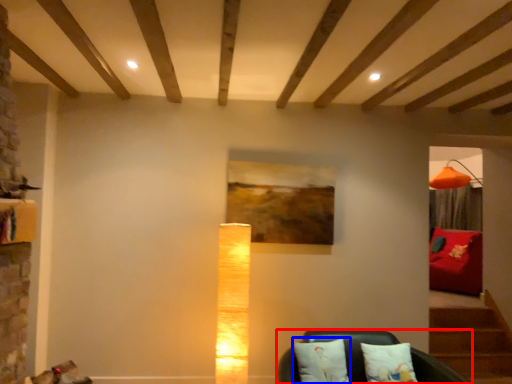
Question: Among these objects, which one is farthest to the camera, furniture (highlighted by a red box) or pillow (highlighted by a blue box)?

Choices:
 (A) furniture
 (B) pillow

Answer: (B)